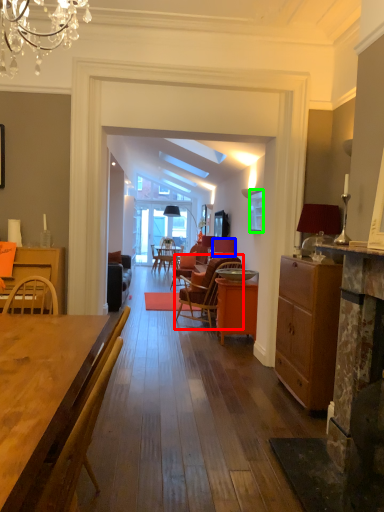
Question: Which object is the farthest from chair (highlighted by a red box)? Choose among these: loudspeaker (highlighted by a blue box) or picture frame (highlighted by a green box).

Choices:
 (A) loudspeaker
 (B) picture frame

Answer: (B)